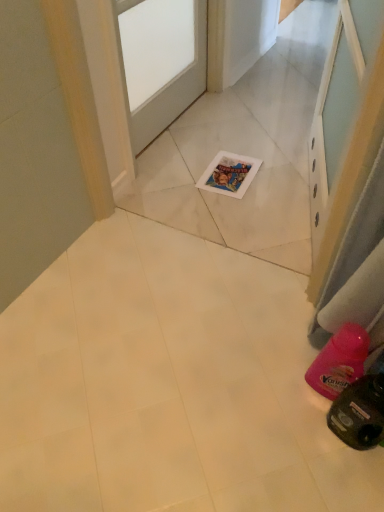
The height and width of the screenshot is (512, 384). What are the coordinates of `free spot in front of white matte door at center` in the screenshot? It's located at (203, 177).